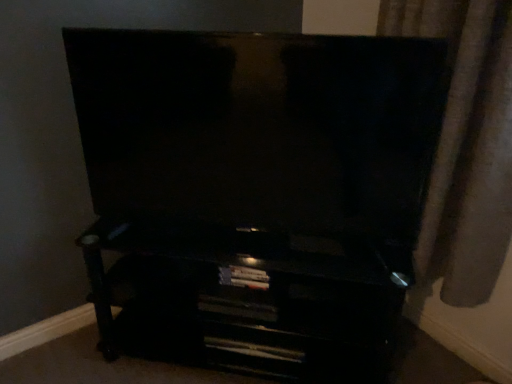
You are a GUI agent. You are given a task and a screenshot of the screen. Output one action in this format:
    pyautogui.click(x=<x>, y=<y>)
    Task: Click on the matte black tv at center
    This screenshot has width=512, height=384.
    Given the screenshot: What is the action you would take?
    pyautogui.click(x=255, y=194)

The height and width of the screenshot is (384, 512). I want to click on black glossy entertainment center at lower center, so click(x=249, y=297).

Is black glossy entertainment center at lower center surrounded by satin beige curtain at right?

That's incorrect, black glossy entertainment center at lower center is not inside satin beige curtain at right.

Could you tell me if satin beige curtain at right is turned towards black glossy entertainment center at lower center?

Yes, satin beige curtain at right is aimed at black glossy entertainment center at lower center.

Who is bigger, satin beige curtain at right or black glossy entertainment center at lower center?

black glossy entertainment center at lower center.

How many degrees apart are the facing directions of satin beige curtain at right and black glossy entertainment center at lower center?

The facing directions of satin beige curtain at right and black glossy entertainment center at lower center are 39 degrees apart.

Is matte black tv at center far away from satin beige curtain at right?

No.

Is matte black tv at center positioned behind satin beige curtain at right?

Yes, it is.

Could you tell me if matte black tv at center is turned towards satin beige curtain at right?

No.

Does point (78, 86) come in front of point (481, 197)?

No, it is behind (481, 197).

Does matte black tv at center have a greater width compared to black glossy entertainment center at lower center?

In fact, matte black tv at center might be narrower than black glossy entertainment center at lower center.

From the image's perspective, between matte black tv at center and black glossy entertainment center at lower center, which one is located above?

matte black tv at center appears higher in the image.

Based on the photo, is black glossy entertainment center at lower center a part of matte black tv at center?

Definitely not — black glossy entertainment center at lower center is not inside matte black tv at center.

Is matte black tv at center far from black glossy entertainment center at lower center?

No, matte black tv at center is in close proximity to black glossy entertainment center at lower center.

Choose the correct answer: Is satin beige curtain at right inside matte black tv at center or outside it?

satin beige curtain at right is not inside matte black tv at center, it's outside.

Is satin beige curtain at right oriented away from matte black tv at center?

No, satin beige curtain at right's orientation is not away from matte black tv at center.

Can you confirm if satin beige curtain at right is bigger than matte black tv at center?

Indeed, satin beige curtain at right has a larger size compared to matte black tv at center.

Consider the image. From a real-world perspective, is satin beige curtain at right physically below matte black tv at center?

Yes, from a real-world perspective, satin beige curtain at right is beneath matte black tv at center.

Between black glossy entertainment center at lower center and satin beige curtain at right, which one has larger width?

Wider between the two is black glossy entertainment center at lower center.

Considering the positions of point (117, 319) and point (474, 103), is point (117, 319) closer or farther from the camera than point (474, 103)?

Point (117, 319) appears to be farther away from the viewer than point (474, 103).

From a real-world perspective, is black glossy entertainment center at lower center on top of satin beige curtain at right?

Incorrect, from a real-world perspective, black glossy entertainment center at lower center is lower than satin beige curtain at right.

Considering the sizes of objects black glossy entertainment center at lower center and satin beige curtain at right in the image provided, who is taller, black glossy entertainment center at lower center or satin beige curtain at right?

satin beige curtain at right.

Is black glossy entertainment center at lower center wider than matte black tv at center?

Yes.

Considering the relative positions of black glossy entertainment center at lower center and matte black tv at center in the image provided, is black glossy entertainment center at lower center behind matte black tv at center?

Yes, it is behind matte black tv at center.

Is black glossy entertainment center at lower center next to matte black tv at center and touching it?

Yes, black glossy entertainment center at lower center is touching matte black tv at center.

Based on their sizes in the image, would you say black glossy entertainment center at lower center is bigger or smaller than matte black tv at center?

In the image, black glossy entertainment center at lower center appears to be larger than matte black tv at center.

The height and width of the screenshot is (384, 512). Find the location of `entertainment center below the satin beige curtain at right (from a real-world perspective)`. entertainment center below the satin beige curtain at right (from a real-world perspective) is located at coordinates (249, 297).

Where is `furniture on the left of the satin beige curtain at right`? furniture on the left of the satin beige curtain at right is located at coordinates (255, 194).

Estimate the real-world distances between objects in this image. Which object is closer to black glossy entertainment center at lower center, satin beige curtain at right or matte black tv at center?

matte black tv at center is closer to black glossy entertainment center at lower center.

Estimate the real-world distances between objects in this image. Which object is closer to matte black tv at center, black glossy entertainment center at lower center or satin beige curtain at right?

Based on the image, black glossy entertainment center at lower center appears to be nearer to matte black tv at center.

Estimate the real-world distances between objects in this image. Which object is closer to satin beige curtain at right, black glossy entertainment center at lower center or matte black tv at center?

The object closer to satin beige curtain at right is matte black tv at center.

Which object lies further to the anchor point black glossy entertainment center at lower center, matte black tv at center or satin beige curtain at right?

The object further to black glossy entertainment center at lower center is satin beige curtain at right.

Estimate the real-world distances between objects in this image. Which object is further from matte black tv at center, satin beige curtain at right or black glossy entertainment center at lower center?

Among the two, satin beige curtain at right is located further to matte black tv at center.

Estimate the real-world distances between objects in this image. Which object is closer to satin beige curtain at right, matte black tv at center or black glossy entertainment center at lower center?

matte black tv at center lies closer to satin beige curtain at right than the other object.

Locate an element on the screen. entertainment center between matte black tv at center and satin beige curtain at right is located at coordinates (249, 297).